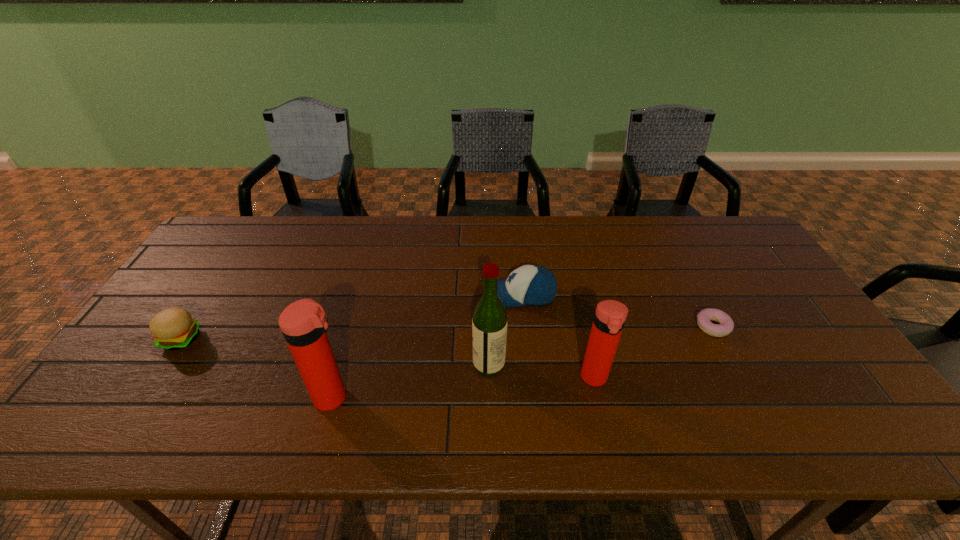
Image resolution: width=960 pixels, height=540 pixels. Identify the location of empty space between the second shortest object and the shorter thermos bottle. (388, 358).

At what (x,y) coordinates should I click in order to perform the action: click on vacant space that's between the liquor and the hamburger. Please return your answer as a coordinate pair (x, y). This screenshot has width=960, height=540. Looking at the image, I should click on (335, 351).

Locate an element on the screen. The width and height of the screenshot is (960, 540). free area in between the fifth tallest object and the third shortest object is located at coordinates (x=351, y=317).

The image size is (960, 540). Identify the location of free space between the third tallest object and the doughnut. (654, 353).

Locate an element on the screen. The height and width of the screenshot is (540, 960). free space between the second object from right to left and the fifth object from right to left is located at coordinates coord(464,388).

Where is `vacant area that lies between the rightmost object and the second object from right to left`? Image resolution: width=960 pixels, height=540 pixels. vacant area that lies between the rightmost object and the second object from right to left is located at coordinates (654, 353).

Where is `object that is the closest to the liquor`? The width and height of the screenshot is (960, 540). object that is the closest to the liquor is located at coordinates (532, 285).

Point out which object is positioned as the nearest to the third shortest object. Please provide its 2D coordinates. Your answer should be formatted as a tuple, i.e. [(x, y)], where the tuple contains the x and y coordinates of a point satisfying the conditions above.

[(489, 323)]

The height and width of the screenshot is (540, 960). In order to click on free space that satisfies the following two spatial constraints: 1. on the front-facing side of the shortest object; 2. on the left side of the third shortest object in this screenshot , I will do `click(525, 327)`.

At what (x,y) coordinates should I click in order to perform the action: click on free point that satisfies the following two spatial constraints: 1. on the label of the right thermos bottle; 2. on the left side of the liquor. Please return your answer as a coordinate pair (x, y). This screenshot has height=540, width=960. Looking at the image, I should click on (490, 378).